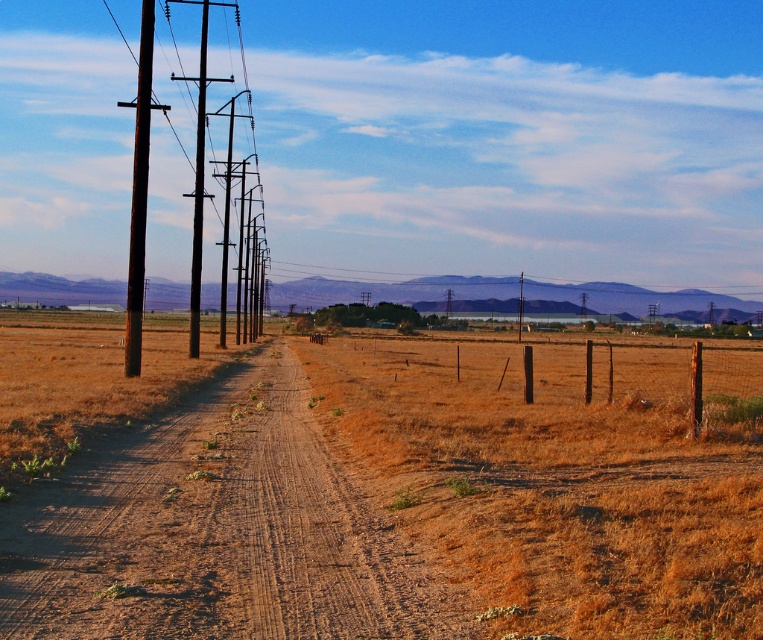
Question: Can you confirm if brown dry grass at center is bigger than brown wire fence at center?

Choices:
 (A) yes
 (B) no

Answer: (B)

Question: Does rusty metal telegraph pole at left appear on the left side of brown wooden telegraph pole at left?

Choices:
 (A) no
 (B) yes

Answer: (B)

Question: Which object is closer to the camera taking this photo?

Choices:
 (A) brown wooden telegraph pole at left
 (B) brown dry grass at center
 (C) metallic gray power line at center

Answer: (B)

Question: Estimate the real-world distances between objects in this image. Which object is closer to the brown wooden telegraph pole at left?

Choices:
 (A) brown sandy dirt track at center
 (B) metallic gray power line at center

Answer: (A)

Question: Is rusty metal telegraph pole at left thinner than brown wooden telegraph pole at left?

Choices:
 (A) yes
 (B) no

Answer: (B)

Question: Which point is farther to the camera?

Choices:
 (A) (134, 200)
 (B) (198, 285)
 (C) (539, 401)
 (D) (733, 374)

Answer: (D)